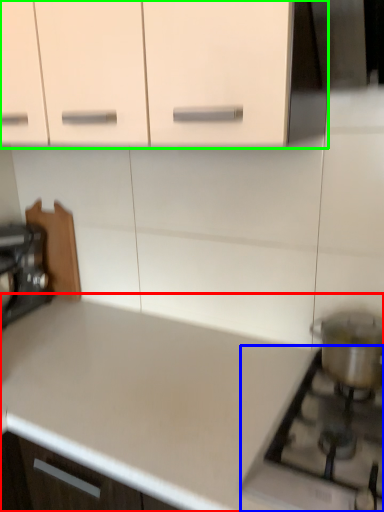
Question: Which object is positioned closest to countertop (highlighted by a red box)? Select from gas stove (highlighted by a blue box) and cabinetry (highlighted by a green box).

Choices:
 (A) gas stove
 (B) cabinetry

Answer: (A)